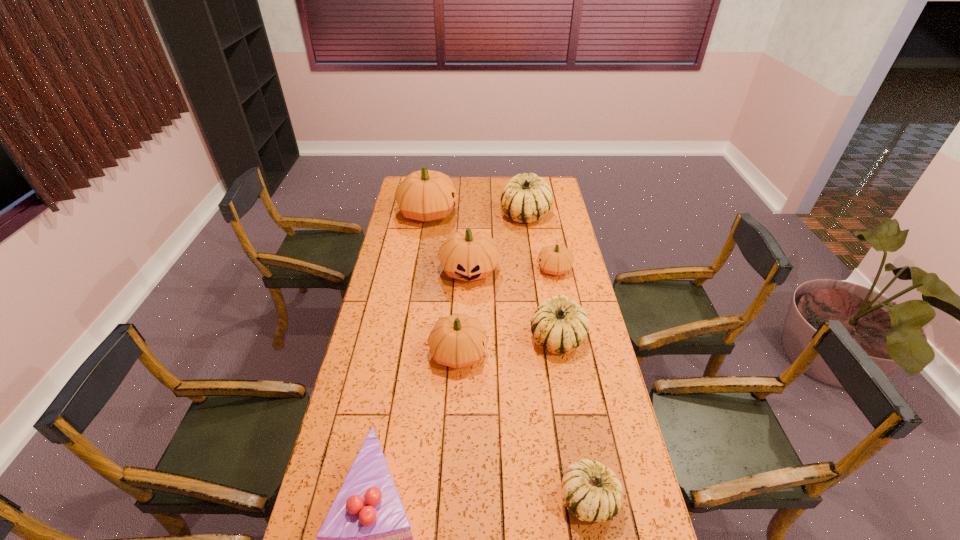
Find the location of a particular element. The image size is (960, 540). free spot located on the side of the second biggest orange gourd with the carved face is located at coordinates (468, 330).

Locate an element on the screen. vacant point located on the front of the biggest white gourd is located at coordinates (533, 265).

Find the location of a particular element. The width and height of the screenshot is (960, 540). free space located 0.240m on the side of the second smallest orange gourd with the carved face is located at coordinates (556, 353).

The image size is (960, 540). In order to click on vacant space positioned on the back of the second biggest white gourd in this screenshot , I will do `click(547, 280)`.

The width and height of the screenshot is (960, 540). I want to click on blank space located 0.320m on the side of the smallest orange gourd with the carved face, so click(x=463, y=269).

At what (x,y) coordinates should I click in order to perform the action: click on vacant area located on the side of the smallest orange gourd with the carved face. Please return your answer as a coordinate pair (x, y). The height and width of the screenshot is (540, 960). Looking at the image, I should click on (511, 269).

This screenshot has height=540, width=960. Identify the location of blank space located on the side of the smallest orange gourd with the carved face. (488, 269).

At what (x,y) coordinates should I click in order to perform the action: click on vacant space located on the left of the nearest white gourd. Please return your answer as a coordinate pair (x, y). Looking at the image, I should click on (482, 499).

Find the location of a particular element. The image size is (960, 540). object present at the far edge is located at coordinates (426, 195).

In order to click on object at the left edge in this screenshot , I will do `click(426, 195)`.